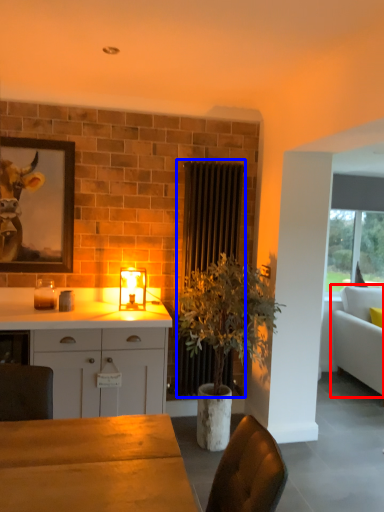
Question: Which object appears farthest to the camera in this image, studio couch (highlighted by a red box) or radiator (highlighted by a blue box)?

Choices:
 (A) studio couch
 (B) radiator

Answer: (A)